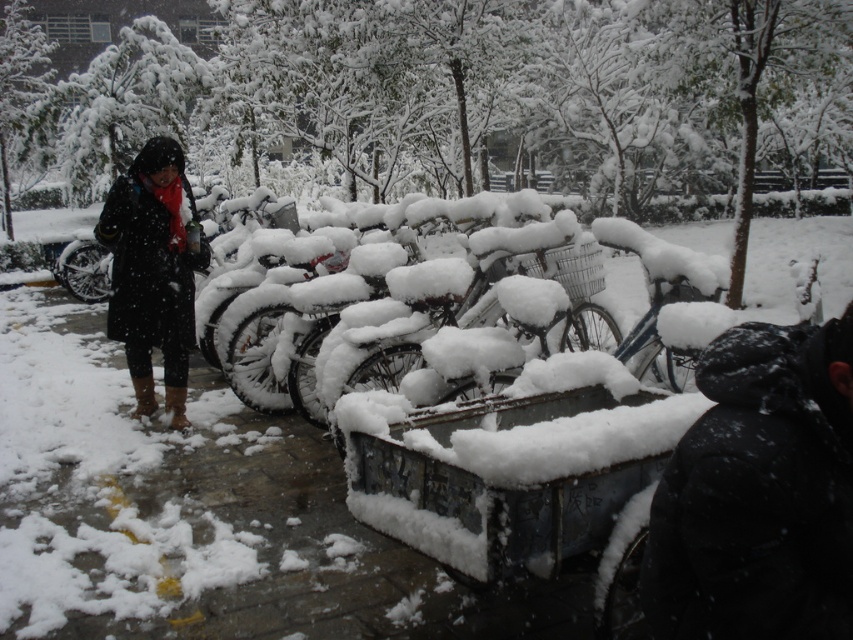
Question: Which point is closer to the camera taking this photo?

Choices:
 (A) (694, 632)
 (B) (531, 432)
 (C) (151, 209)

Answer: (A)

Question: Which object is the closest to the black matte coat at left?

Choices:
 (A) snow-covered metal bicycle at center
 (B) black fuzzy hat at upper right

Answer: (A)

Question: Is black fuzzy hat at upper right further to the viewer compared to black matte coat at left?

Choices:
 (A) yes
 (B) no

Answer: (B)

Question: Which object is closer to the camera taking this photo?

Choices:
 (A) black fuzzy hat at upper right
 (B) metallic gray cart at center
 (C) black matte coat at left

Answer: (A)

Question: Where is black fuzzy hat at upper right located in relation to snow-covered metal bicycle at center in the image?

Choices:
 (A) above
 (B) below

Answer: (B)

Question: Is metallic gray cart at center above snow-covered metal bicycle at center?

Choices:
 (A) no
 (B) yes

Answer: (A)